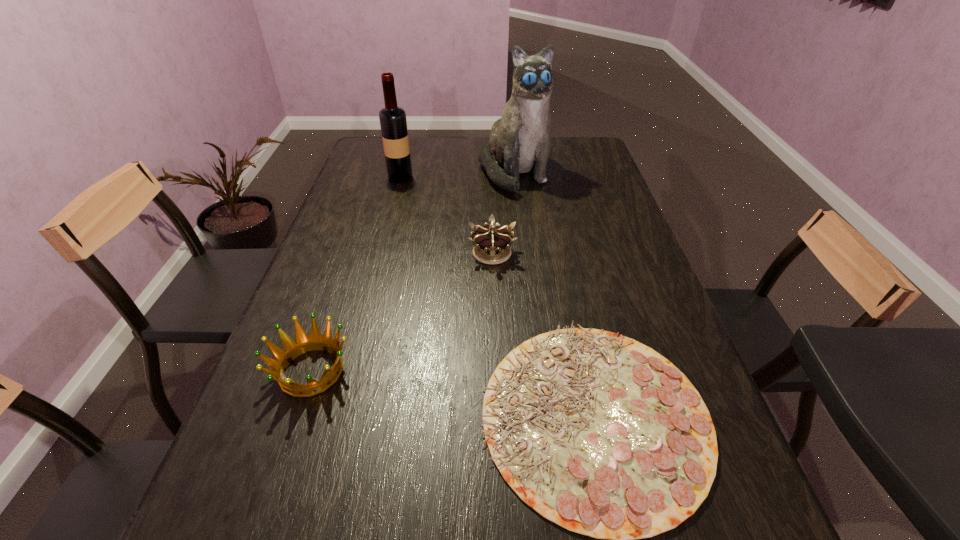
Where is `cat`? The width and height of the screenshot is (960, 540). cat is located at coordinates (519, 142).

This screenshot has height=540, width=960. Identify the location of the second tallest object. (393, 123).

You are a GUI agent. You are given a task and a screenshot of the screen. Output one action in this format:
    pyautogui.click(x=<x>, y=<y>)
    Task: Click on the third nearest object
    This screenshot has width=960, height=540.
    Given the screenshot: What is the action you would take?
    pyautogui.click(x=492, y=244)

In order to click on the farther crown in this screenshot , I will do `click(492, 244)`.

I want to click on the left crown, so click(x=303, y=344).

Where is `free space located 0.230m at the face of the cat`? This screenshot has width=960, height=540. free space located 0.230m at the face of the cat is located at coordinates (522, 242).

Find the location of `vacant space situated 0.060m on the front of the fourth shortest object`. vacant space situated 0.060m on the front of the fourth shortest object is located at coordinates (396, 193).

Find the location of a particular element. The width and height of the screenshot is (960, 540). vacant position located on the front of the right crown is located at coordinates (495, 369).

Where is `vacant space located 0.130m on the right of the nearer crown`? vacant space located 0.130m on the right of the nearer crown is located at coordinates (414, 371).

You are a GUI agent. You are given a task and a screenshot of the screen. Output one action in this format:
    pyautogui.click(x=<x>, y=<y>)
    Task: Click on the object that is at the far edge
    This screenshot has height=540, width=960.
    Given the screenshot: What is the action you would take?
    pyautogui.click(x=519, y=142)